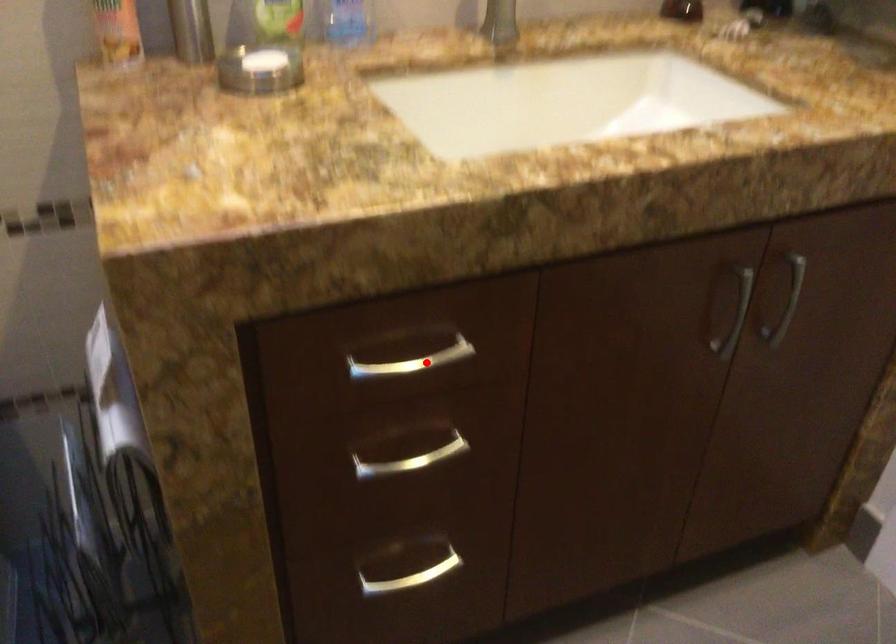
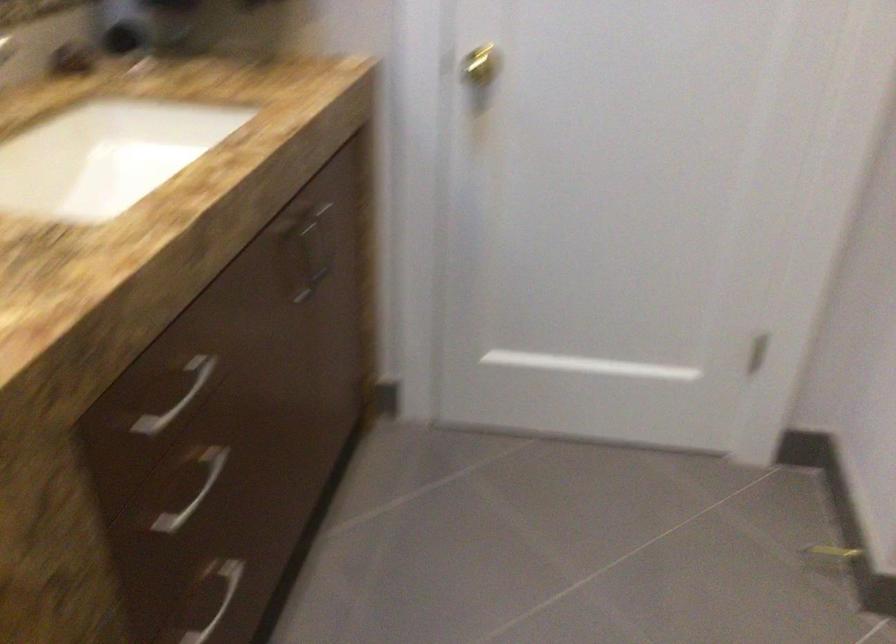
In the second image, find the point that corresponds to the highlighted location in the first image.

(177, 397)